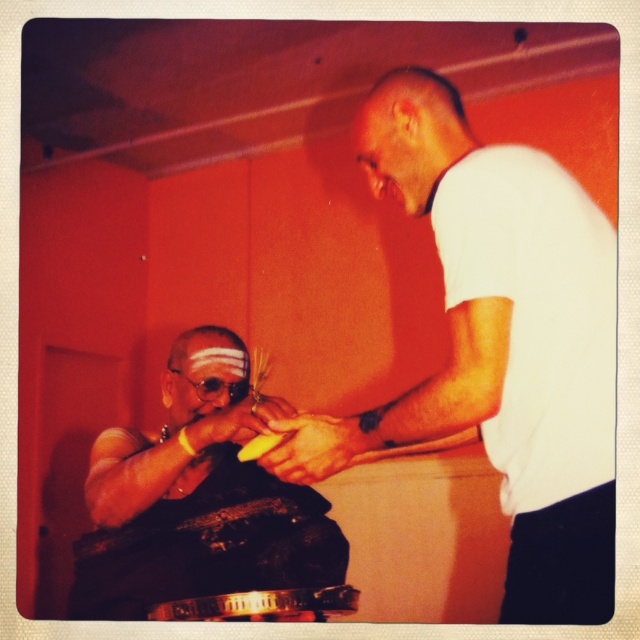
Question: Is white matte shirt at center to the right of matte black cloth at center from the viewer's perspective?

Choices:
 (A) no
 (B) yes

Answer: (B)

Question: Does white matte shirt at center have a larger size compared to matte black cloth at center?

Choices:
 (A) yes
 (B) no

Answer: (A)

Question: Can you confirm if white matte shirt at center is wider than matte black cloth at center?

Choices:
 (A) yes
 (B) no

Answer: (B)

Question: Among these points, which one is nearest to the camera?

Choices:
 (A) (429, 108)
 (B) (291, 518)

Answer: (A)

Question: Which point is farther from the camera taking this photo?

Choices:
 (A) (225, 376)
 (B) (544, 266)

Answer: (A)